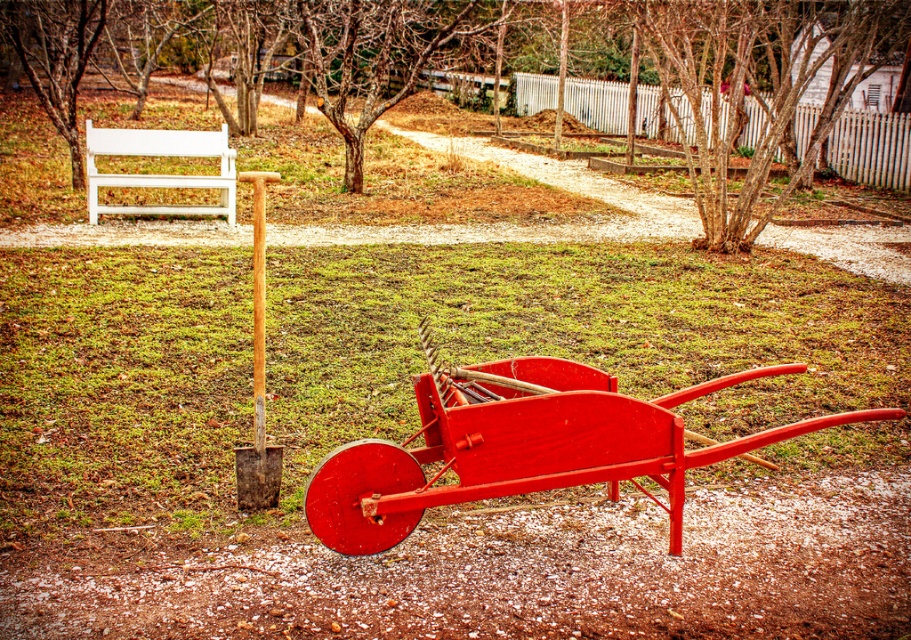
Looking at this image, you are a gardener who needs to move a heavy bag of soil from the matte red wagon at center to the brown textured tree at center. Which direction should you move the bag to reach the tree?

The matte red wagon at center is located below the brown textured tree at center, so you should move the bag upward or northward to reach the tree.